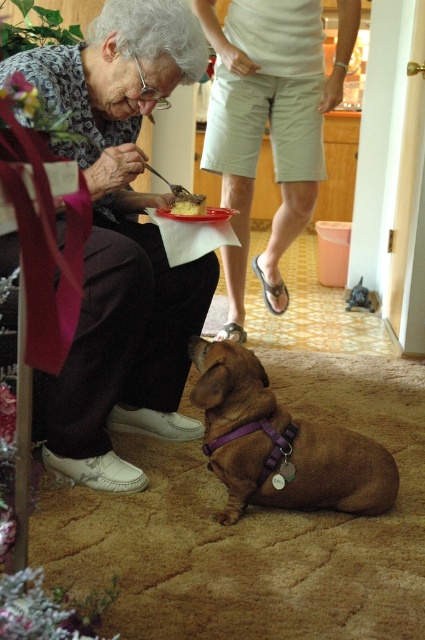
Question: Does light beige shorts at center have a lesser width compared to matte plastic tray at lower center?

Choices:
 (A) no
 (B) yes

Answer: (A)

Question: Does matte black sweater at upper left appear on the right side of matte plastic tray at lower center?

Choices:
 (A) yes
 (B) no

Answer: (B)

Question: Based on their relative distances, which object is farther from the golden crumbly cake at lower center?

Choices:
 (A) matte plastic tray at lower center
 (B) matte plastic plate at center
 (C) brown leather dog at lower center

Answer: (C)

Question: Which is farther from the matte black sweater at upper left?

Choices:
 (A) matte plastic plate at center
 (B) golden crumbly cake at lower center

Answer: (A)

Question: Which point is farther from the camera taking this photo?

Choices:
 (A) (195, 200)
 (B) (187, 209)

Answer: (A)

Question: Is matte black sweater at upper left wider than golden crumbly cake at lower center?

Choices:
 (A) no
 (B) yes

Answer: (B)